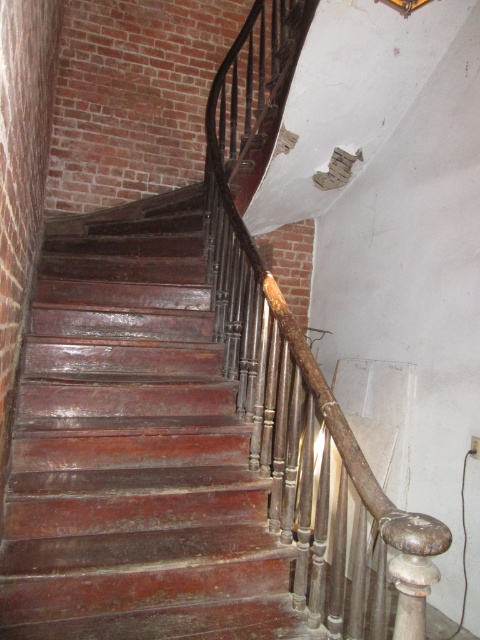
You are standing in front of the spiral staircase and want to take a photo of the shiny wood stairs at center. If your camera has a minimum focusing distance of 5 feet, will you be able to take a clear photo without moving closer?

The distance between the shiny wood stairs at center and the camera is 5.73 feet, which is greater than the minimum focusing distance of 5 feet. Therefore, you can take a clear photo without moving closer.

You are standing at the base of the spiral staircase in the image. There is a shiny wood stairs at center marked by point (134,449). If you want to reach the point marked by this coordinate, which direction should you walk relative to the staircase?

To reach the point marked by (134,449), you should walk towards the center of the spiral staircase since the shiny wood stairs at center is represented by that coordinate.

You are standing at the bottom of the spiral staircase and want to place a small potted plant between the shiny wood stairs at center and the rusty metal railing at center. Is there enough space for the plant?

The shiny wood stairs at center is 20.39 inches away from the rusty metal railing at center, so there is enough space to place a small potted plant between them.